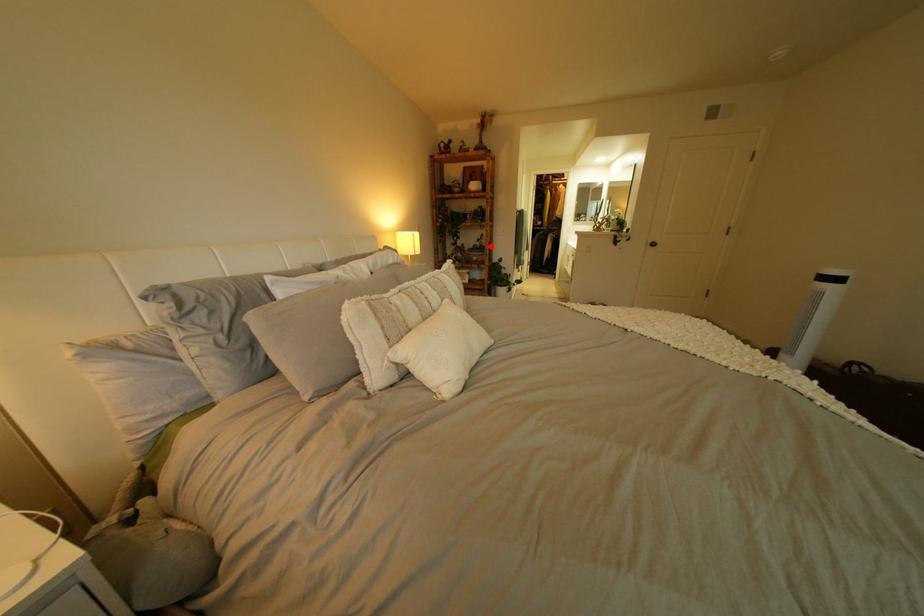
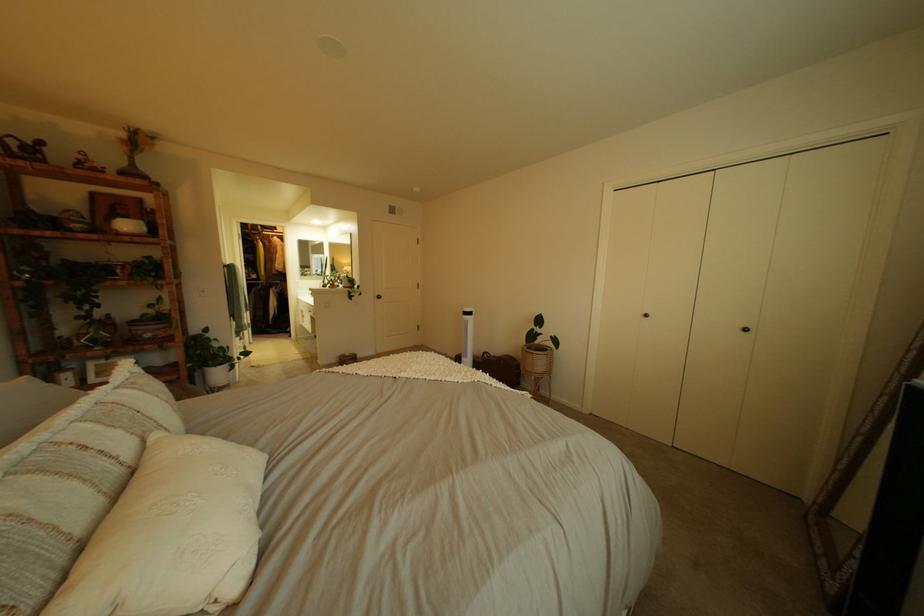
Find the pixel in the second image that matches the highlighted location in the first image.

(161, 315)